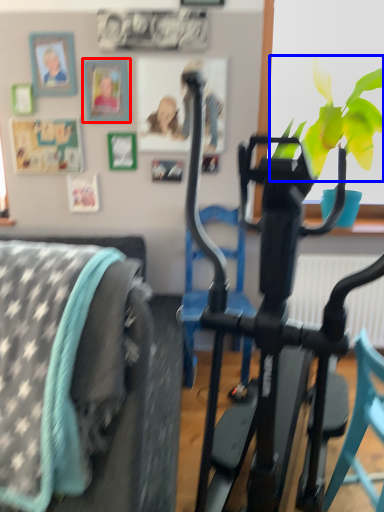
Question: Among these objects, which one is farthest to the camera, picture frame (highlighted by a red box) or flower (highlighted by a blue box)?

Choices:
 (A) picture frame
 (B) flower

Answer: (A)